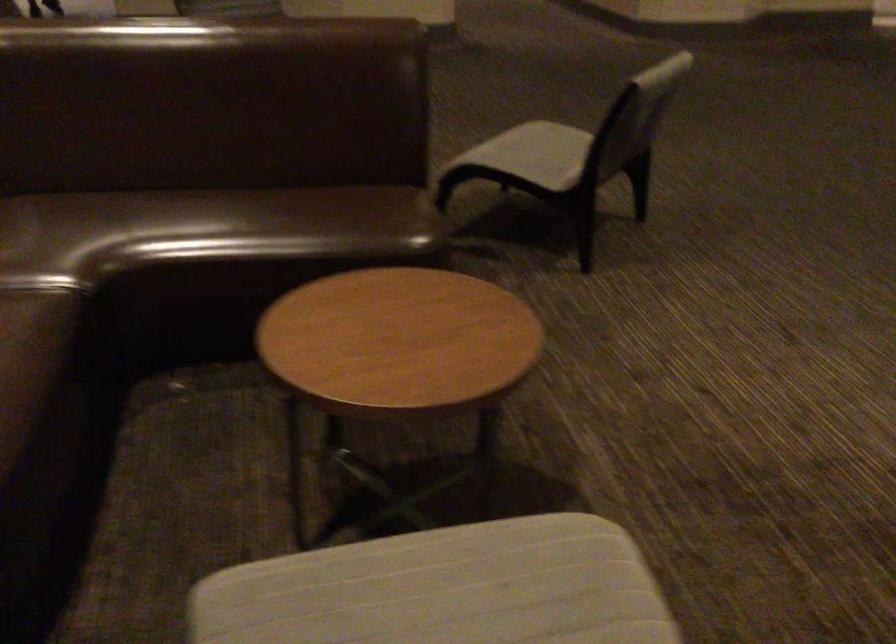
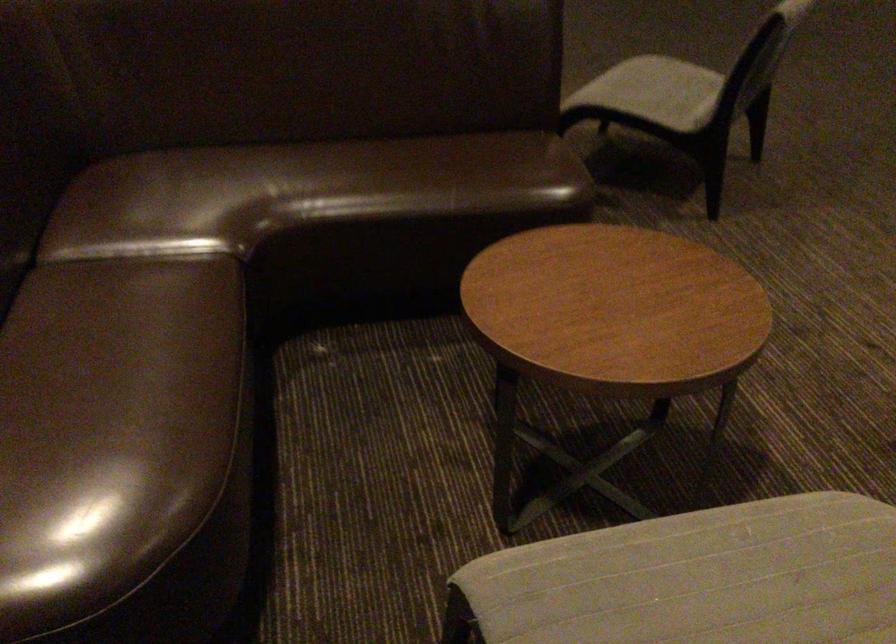
Find the pixel in the second image that matches the point at 531,158 in the first image.

(655, 91)